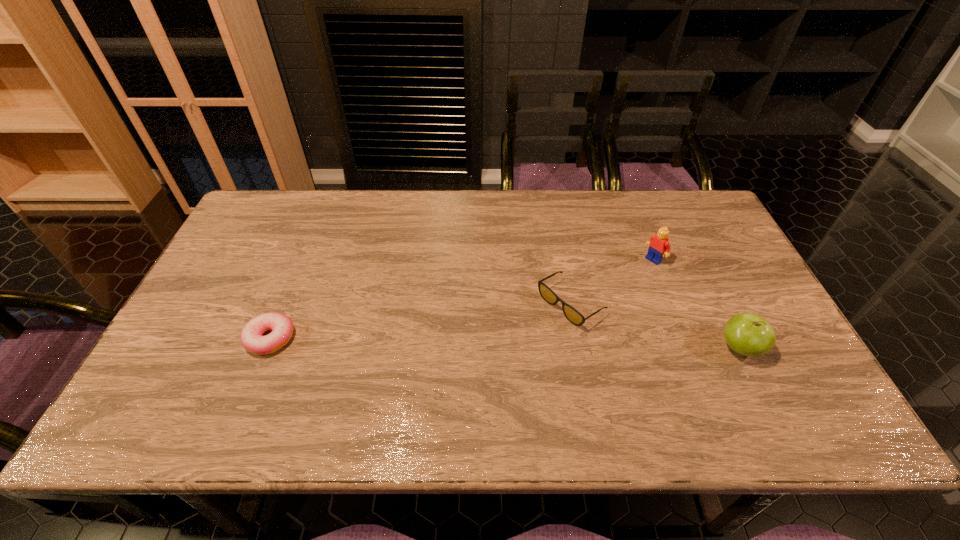
What are the coordinates of `free space on the desktop that is between the leftmost object and the apple and is positioned on the face of the second object from right to left` in the screenshot? It's located at (543, 344).

Where is `free space on the desktop that is between the doughnut and the apple and is positioned on the front-facing side of the sunglasses`? free space on the desktop that is between the doughnut and the apple and is positioned on the front-facing side of the sunglasses is located at coordinates (512, 343).